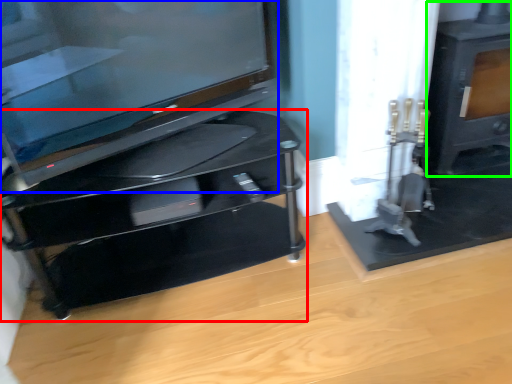
Question: Estimate the real-world distances between objects in this image. Which object is closer to furniture (highlighted by a red box), television (highlighted by a blue box) or stove (highlighted by a green box)?

Choices:
 (A) television
 (B) stove

Answer: (A)